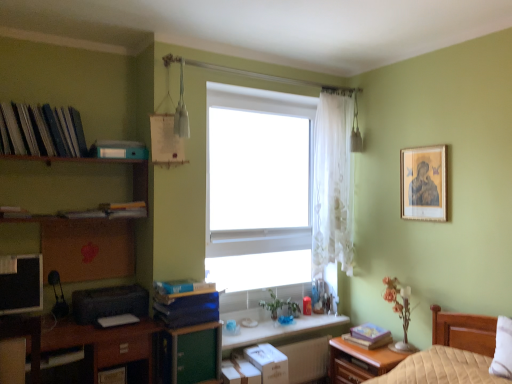
What are the coordinates of `free spot below matte blue bookshelf at upper left, acting as the 2th book starting from the left (from a real-world perspective)` in the screenshot? It's located at (116, 162).